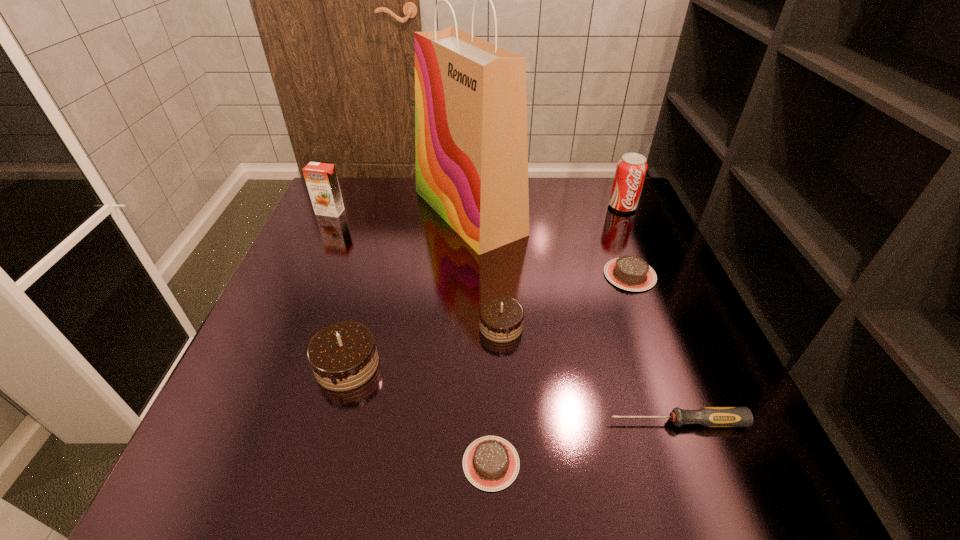
Locate an element on the screen. The image size is (960, 540). the right brown chocolate cake is located at coordinates (631, 273).

Where is `the smaller brown chocolate cake`? This screenshot has width=960, height=540. the smaller brown chocolate cake is located at coordinates (491, 463).

The height and width of the screenshot is (540, 960). I want to click on the nearer brown chocolate cake, so click(491, 463).

This screenshot has width=960, height=540. Identify the location of free space located on the front of the shopping bag. (466, 325).

The height and width of the screenshot is (540, 960). Find the location of `free space located on the logo side of the soda can`. free space located on the logo side of the soda can is located at coordinates (639, 246).

Locate an element on the screen. The image size is (960, 540). free location located on the front of the leftmost object is located at coordinates (293, 294).

Image resolution: width=960 pixels, height=540 pixels. I want to click on free space located on the front of the fourth tallest object, so click(x=325, y=444).

The height and width of the screenshot is (540, 960). What are the coordinates of `vacant region located on the right of the second tallest chocolate cake` in the screenshot? It's located at (571, 326).

You are a GUI agent. You are given a task and a screenshot of the screen. Output one action in this format:
    pyautogui.click(x=<x>, y=<y>)
    Task: Click on the vacant space situated 0.070m insert the screwdriver into a screw head
    The image size is (960, 540).
    Given the screenshot: What is the action you would take?
    pyautogui.click(x=568, y=422)

Where is `vacant region located insert the screwdriver into a screw head`? The height and width of the screenshot is (540, 960). vacant region located insert the screwdriver into a screw head is located at coordinates (421, 422).